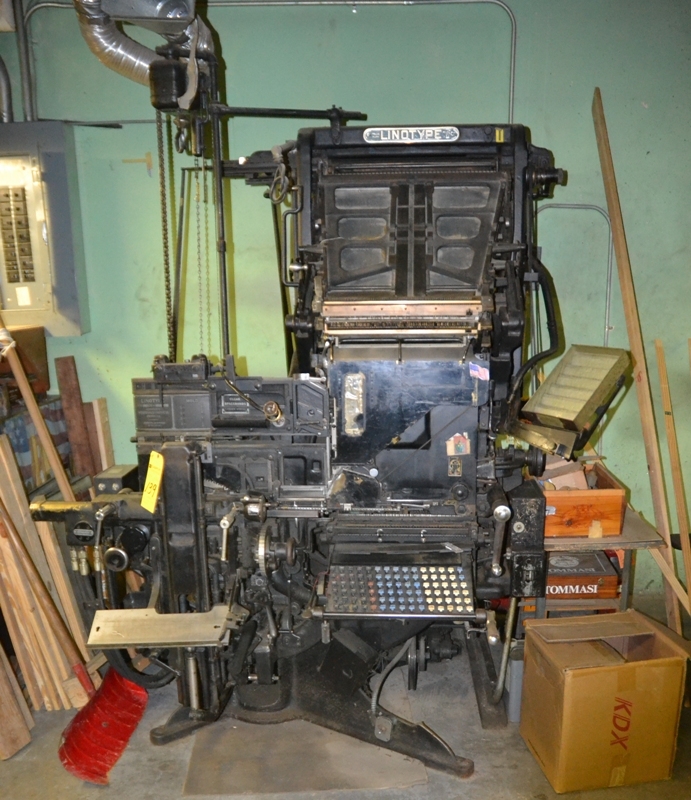
Locate an element on the screen. The height and width of the screenshot is (800, 691). vent hose is located at coordinates click(113, 56).